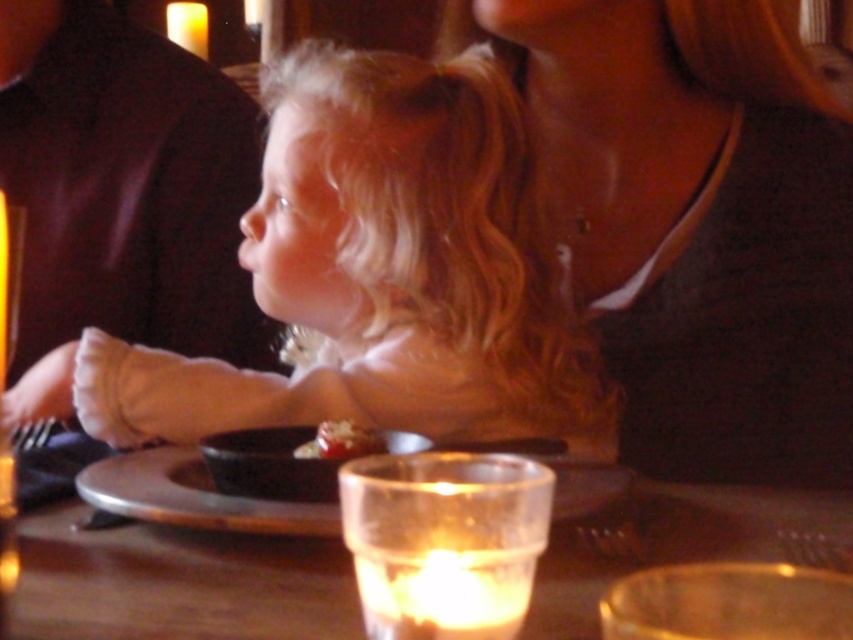
Does matte gold necklace at upper center appear under smooth chocolate cake at center?

No, matte gold necklace at upper center is not below smooth chocolate cake at center.

Based on the photo, can you confirm if matte gold necklace at upper center is wider than smooth chocolate cake at center?

Indeed, matte gold necklace at upper center has a greater width compared to smooth chocolate cake at center.

You are a GUI agent. You are given a task and a screenshot of the screen. Output one action in this format:
    pyautogui.click(x=<x>, y=<y>)
    Task: Click on the matte gold necklace at upper center
    
    Given the screenshot: What is the action you would take?
    pyautogui.click(x=695, y=225)

Who is positioned more to the left, blonde hair at center or matte black shirt at upper left?

matte black shirt at upper left is more to the left.

Is blonde hair at center further to the viewer compared to matte black shirt at upper left?

No, it is not.

Is point (59, 404) in front of point (155, 106)?

That is True.

Where is `blonde hair at center`? The height and width of the screenshot is (640, 853). blonde hair at center is located at coordinates (373, 276).

Who is lower down, transparent glass candle at center or smooth chocolate cake at center?

Positioned lower is transparent glass candle at center.

Can you confirm if transparent glass candle at center is positioned above smooth chocolate cake at center?

No, transparent glass candle at center is not above smooth chocolate cake at center.

Where is `transparent glass candle at center`? transparent glass candle at center is located at coordinates (178, 582).

Find the location of a particular element. This screenshot has width=853, height=640. transparent glass candle at center is located at coordinates (178, 582).